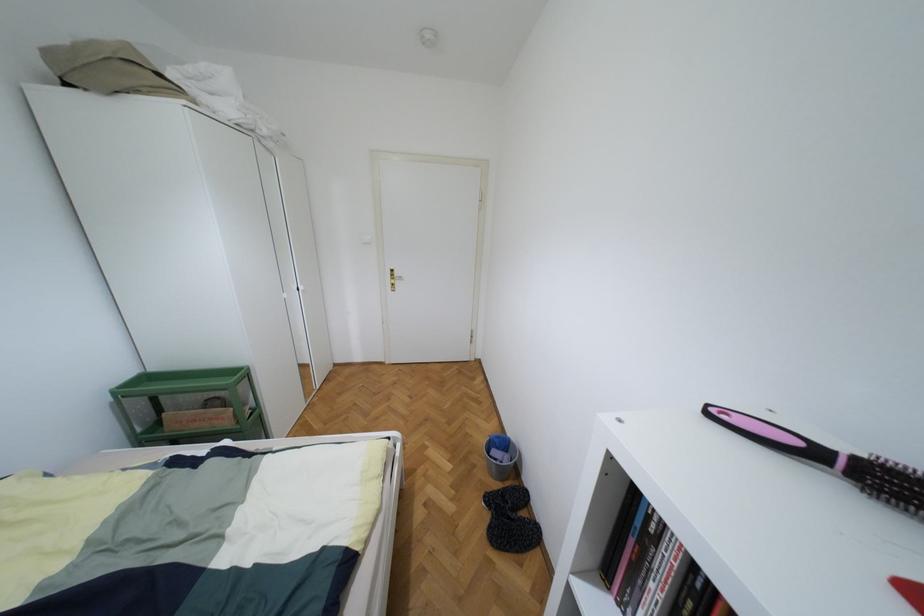
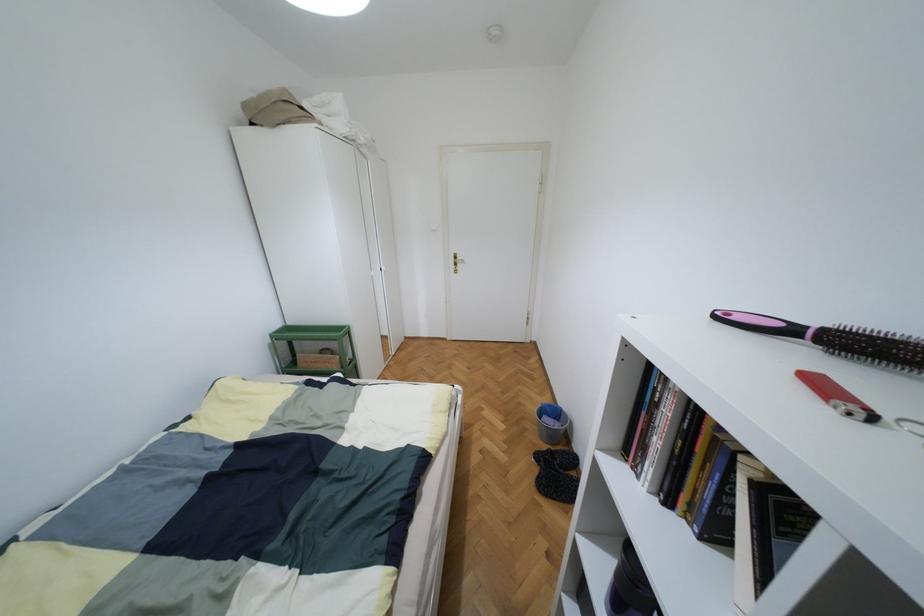
The point at [707,413] is marked in the first image. Where is the corresponding point in the second image?

(713, 315)